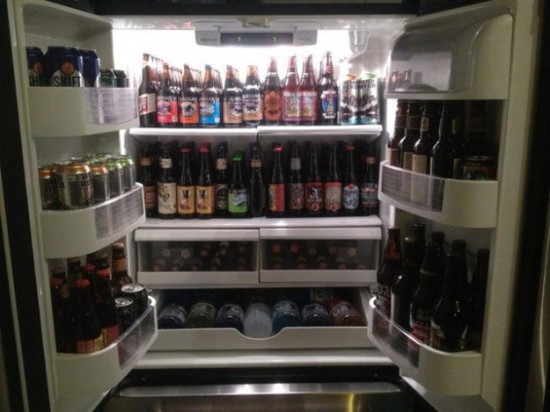
Identify the location of beer bottle. This screenshot has width=550, height=412. (232, 104).